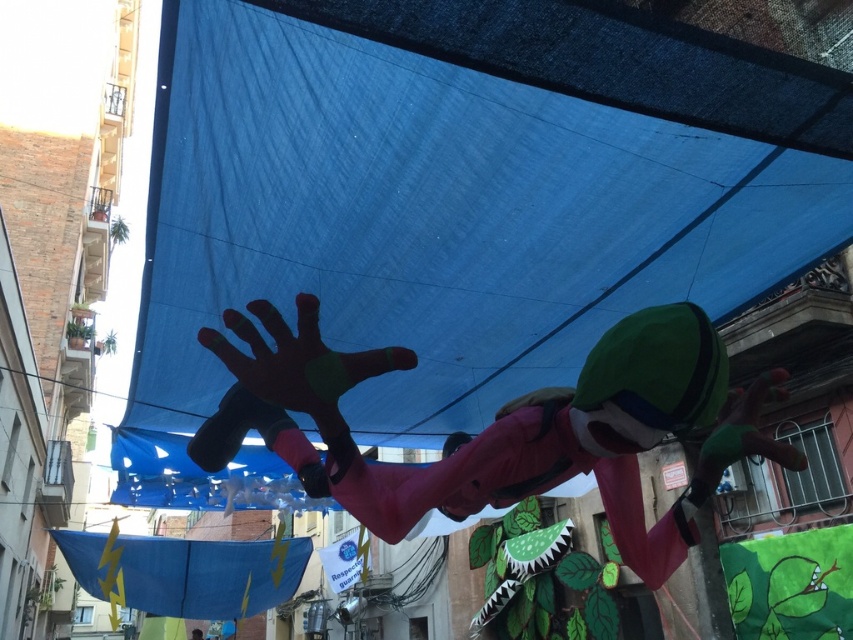
You are an architect designing a new installation and need to place a blue tarpaulin at center. According to the scene, where should you place it?

The blue tarpaulin at center should be placed at point (448,212) as per the coordinates provided.

You are standing at the point labeled point (448,212) in the image. What object are you directly facing?

The point labeled point (448,212) corresponds to the blue tarpaulin at center, so you are directly facing the blue tarpaulin at center.

You are a photographer trying to capture the superhero costume figure in the scene. Since both the blue tarpaulin at center and the pink matte fabric at center are present, which one should you focus on to ensure the superhero costume figure is in the foreground?

The blue tarpaulin at center is located above the pink matte fabric at center, so focusing on the pink matte fabric at center will place the superhero costume figure in the foreground.